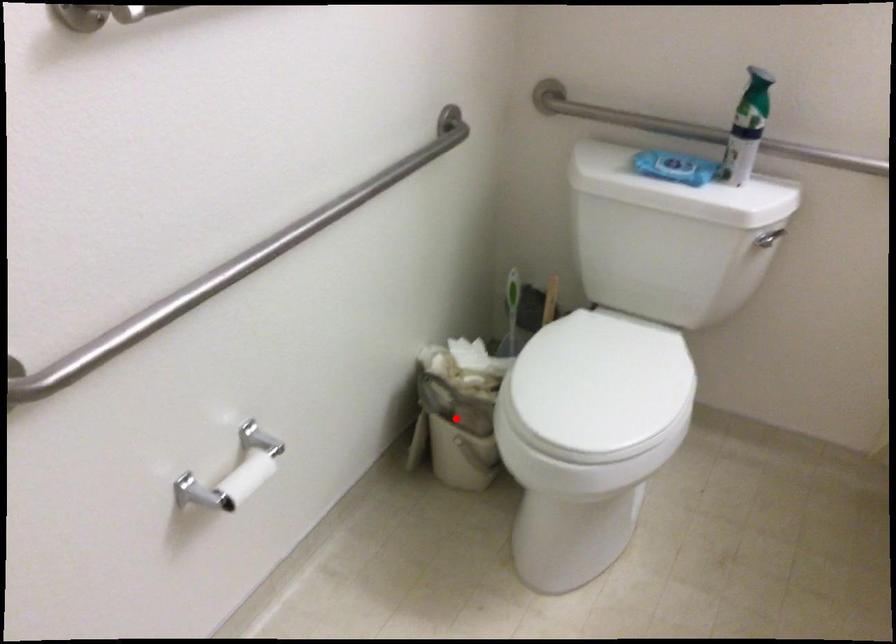
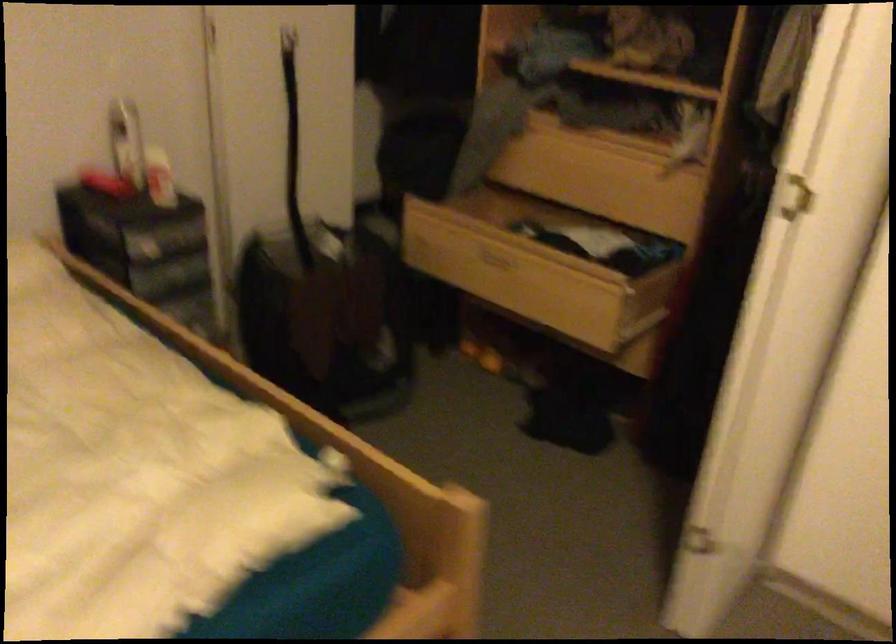
Question: I am providing you with two images of the same scene from different viewpoints. A red point is marked on the first image. Can you still see the location of the red point in image 2?

Choices:
 (A) Yes
 (B) No

Answer: (B)